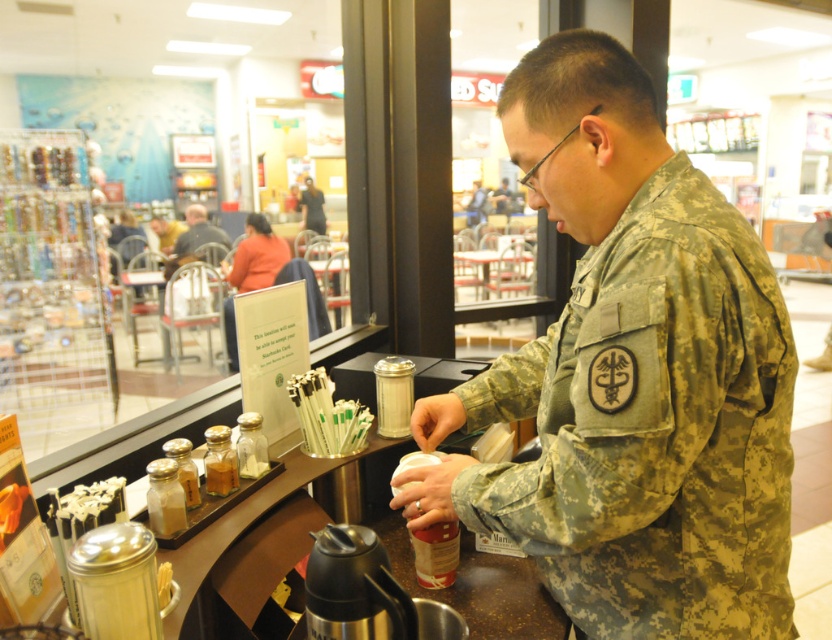
Question: Considering the relative positions of camouflage fabric uniform at center and camouflage uniform at center in the image provided, where is camouflage fabric uniform at center located with respect to camouflage uniform at center?

Choices:
 (A) below
 (B) above

Answer: (A)

Question: Among these points, which one is nearest to the camera?

Choices:
 (A) (176, 243)
 (B) (650, 150)

Answer: (B)

Question: Is blurred skin at center to the right of camouflage uniform at center from the viewer's perspective?

Choices:
 (A) yes
 (B) no

Answer: (B)

Question: Based on their relative distances, which object is nearer to the camouflage uniform at center?

Choices:
 (A) blurred skin at center
 (B) camouflage fabric uniform at center

Answer: (A)

Question: Can you confirm if blurred skin at center is thinner than camouflage uniform at center?

Choices:
 (A) yes
 (B) no

Answer: (B)

Question: Which of these objects is positioned farthest from the blurred skin at center?

Choices:
 (A) camouflage uniform at center
 (B) camouflage fabric uniform at center

Answer: (B)